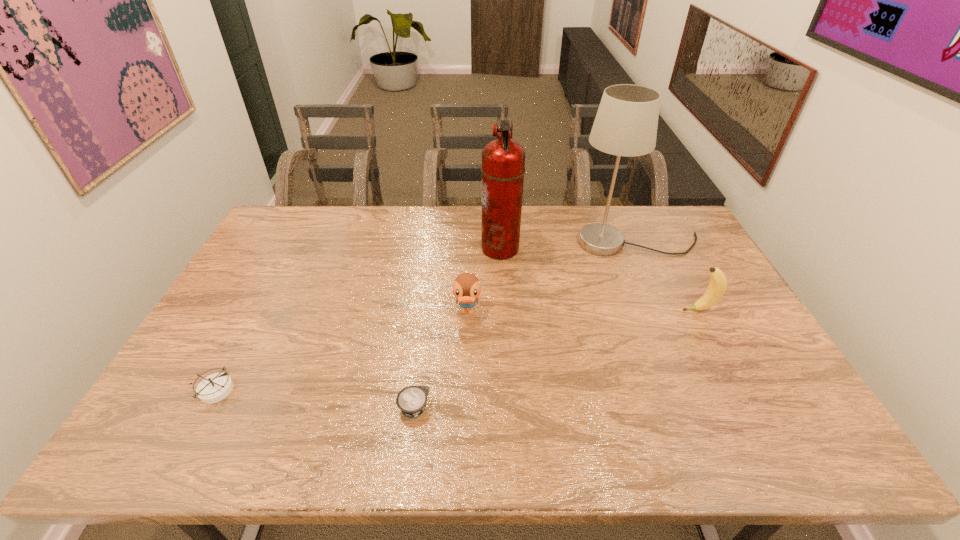
At what (x,y) coordinates should I click in order to perform the action: click on empty location between the fourth object from right to left and the third tallest object. Please return your answer as a coordinate pair (x, y). Looking at the image, I should click on (583, 311).

Find the location of `unoccupied position between the table lamp and the yogurt`. unoccupied position between the table lamp and the yogurt is located at coordinates (525, 326).

Choose which object is the second nearest neighbor to the shortest object. Please provide its 2D coordinates. Your answer should be formatted as a tuple, i.e. [(x, y)], where the tuple contains the x and y coordinates of a point satisfying the conditions above.

[(214, 388)]

The height and width of the screenshot is (540, 960). In order to click on object that is the closest to the duck in this screenshot , I will do `click(503, 160)`.

In order to click on free point that satisfies the following two spatial constraints: 1. on the front side of the yogurt; 2. on the left side of the compass in this screenshot , I will do `click(205, 409)`.

I want to click on vacant region that satisfies the following two spatial constraints: 1. on the back side of the table lamp; 2. on the left side of the yogurt, so click(x=435, y=243).

This screenshot has width=960, height=540. What are the coordinates of `vacant area in the image that satisfies the following two spatial constraints: 1. from the stem of the third tallest object; 2. on the front-facing side of the duck` in the screenshot? It's located at [700, 312].

This screenshot has height=540, width=960. In order to click on vacant space that satisfies the following two spatial constraints: 1. on the nozzle side of the fire extinguisher; 2. on the front-facing side of the fourth tallest object in this screenshot , I will do `click(504, 312)`.

Identify the location of free space that satisfies the following two spatial constraints: 1. on the nozzle side of the fourth object from left to right; 2. on the front side of the compass. This screenshot has height=540, width=960. (508, 391).

You are a GUI agent. You are given a task and a screenshot of the screen. Output one action in this format:
    pyautogui.click(x=<x>, y=<y>)
    Task: Click on the vacant area that satisfies the following two spatial constraints: 1. on the nozzle side of the fire extinguisher; 2. on the front-facing side of the duck
    This screenshot has height=540, width=960.
    Given the screenshot: What is the action you would take?
    pyautogui.click(x=504, y=312)